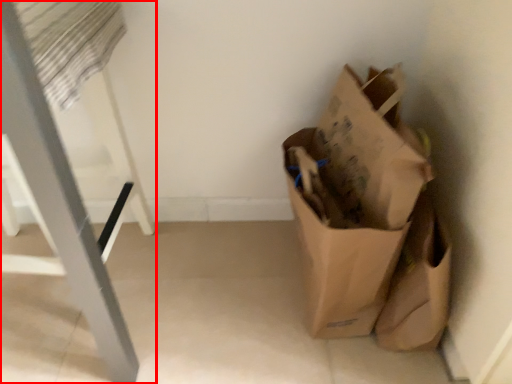
Question: From the image's perspective, what is the correct spatial positioning of furniture (annotated by the red box) in reference to grocery bag?

Choices:
 (A) below
 (B) above

Answer: (B)